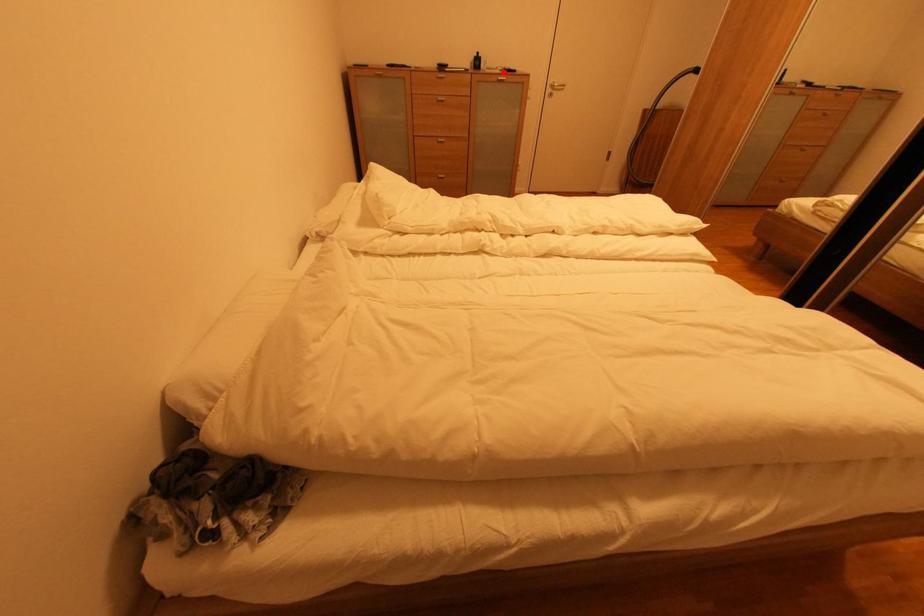
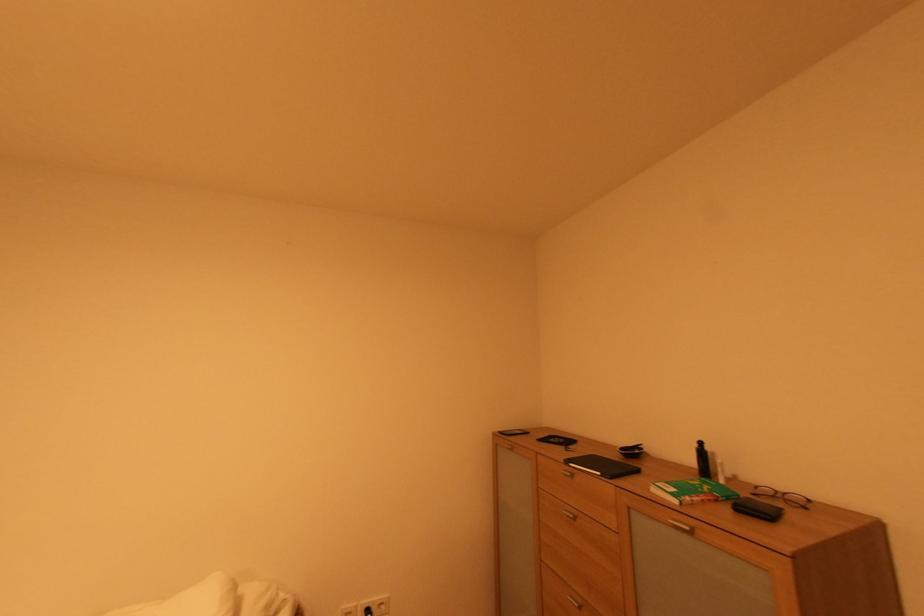
Find the pixel in the second image that matches the highlighted location in the first image.

(682, 503)